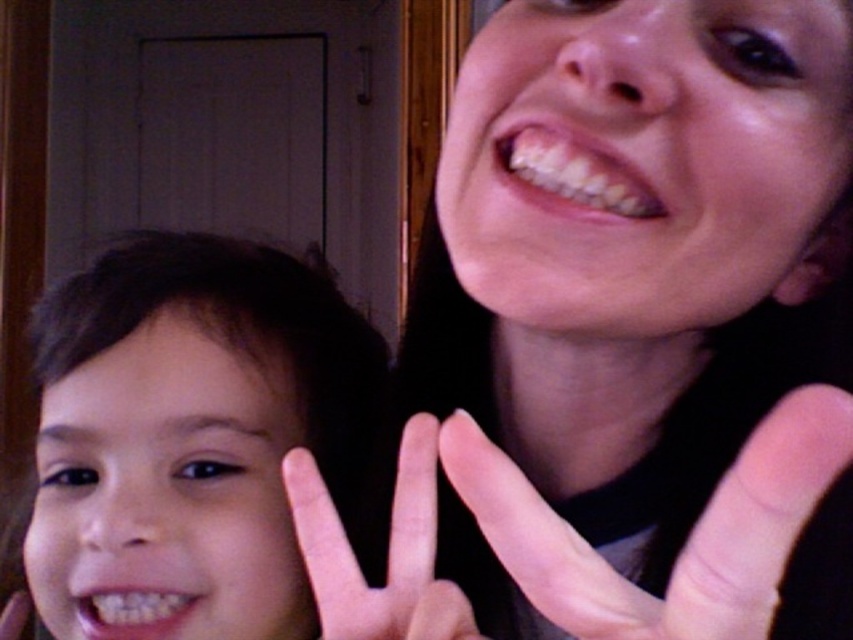
Question: Which of these objects is positioned farthest from the brown hair at left?

Choices:
 (A) pink flesh-colored hand at center
 (B) smooth skin face at upper right

Answer: (A)

Question: Is smooth skin face at upper right smaller than brown hair at left?

Choices:
 (A) no
 (B) yes

Answer: (A)

Question: Which of the following is the closest to the observer?

Choices:
 (A) (42, 445)
 (B) (416, 540)

Answer: (B)

Question: Based on their relative distances, which object is nearer to the pink flesh-toned hand at center?

Choices:
 (A) pink flesh-colored hand at center
 (B) smooth skin face at upper right
 (C) brown hair at left

Answer: (A)

Question: Does smooth skin face at upper right come in front of pink flesh-colored hand at center?

Choices:
 (A) no
 (B) yes

Answer: (B)

Question: Does pink flesh-toned hand at center lie behind pink flesh-colored hand at center?

Choices:
 (A) no
 (B) yes

Answer: (A)